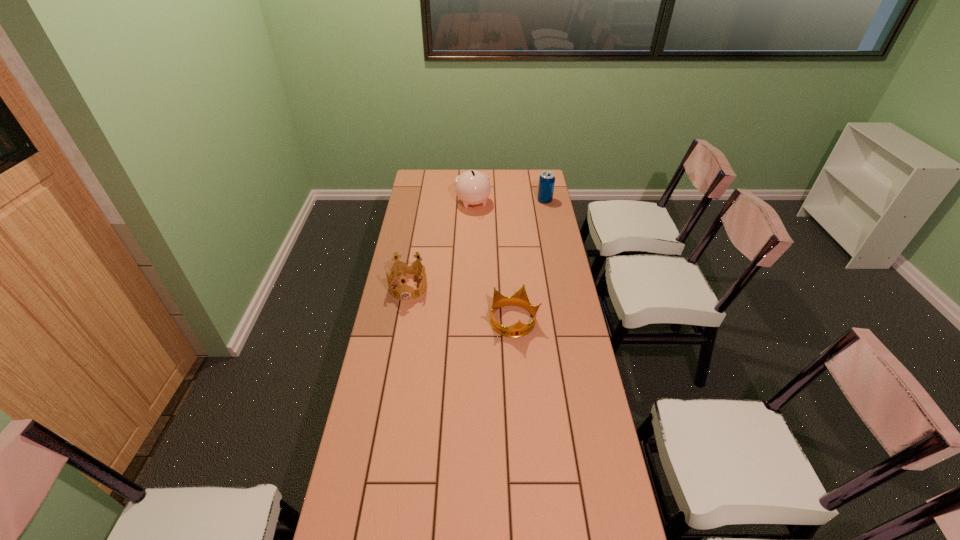
At what (x,y) coordinates should I click in order to perform the action: click on piggy bank. Please return your answer as a coordinate pair (x, y). This screenshot has height=540, width=960. Looking at the image, I should click on (473, 187).

The height and width of the screenshot is (540, 960). Identify the location of the rightmost object. (547, 179).

Find the location of a particular element. the taller crown is located at coordinates 406,274.

I want to click on the farther crown, so click(406, 274).

Where is `the nearer crown`? The height and width of the screenshot is (540, 960). the nearer crown is located at coordinates (519, 329).

Locate an element on the screen. The height and width of the screenshot is (540, 960). the shorter crown is located at coordinates (519, 329).

Identify the location of vacant point located 0.330m on the right of the piggy bank. (553, 204).

Locate an element on the screen. The width and height of the screenshot is (960, 540). vacant space situated on the back of the pop soda is located at coordinates (540, 172).

Identify the location of free space located on the back of the farther crown. (417, 241).

Identify the location of free spot located 0.320m on the left of the shorter crown. (406, 322).